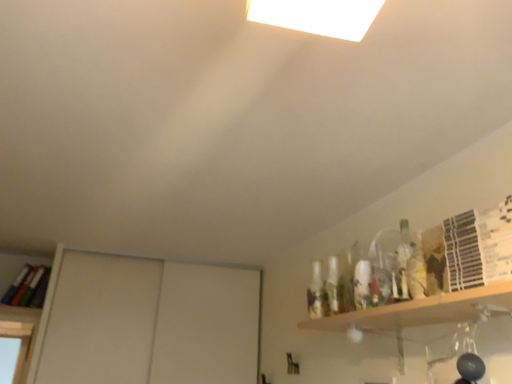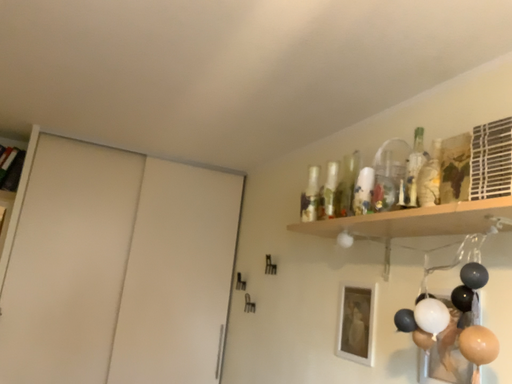
Question: How did the camera likely rotate when shooting the video?

Choices:
 (A) rotated downward
 (B) rotated upward

Answer: (A)